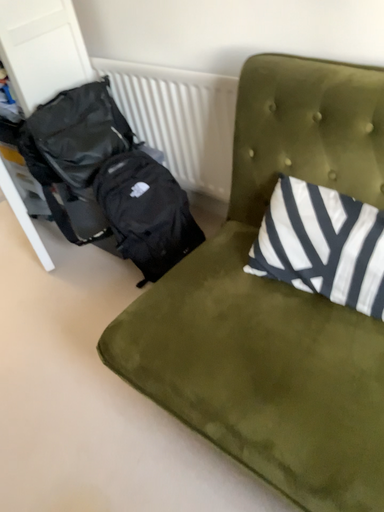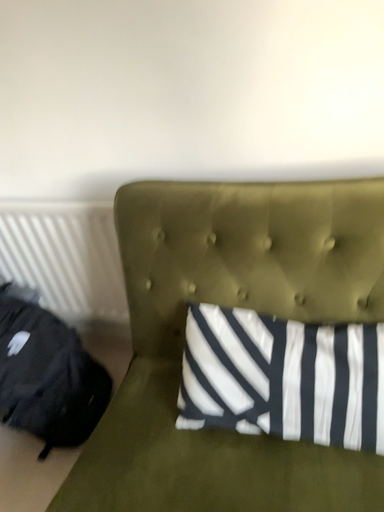
Question: Which way did the camera rotate in the video?

Choices:
 (A) rotated left
 (B) rotated right

Answer: (B)